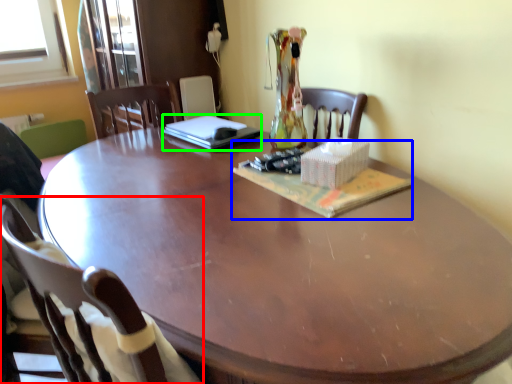
Question: Estimate the real-world distances between objects in this image. Which object is closer to chair (highlighted by a red box), magazine (highlighted by a blue box) or laptop (highlighted by a green box)?

Choices:
 (A) magazine
 (B) laptop

Answer: (A)